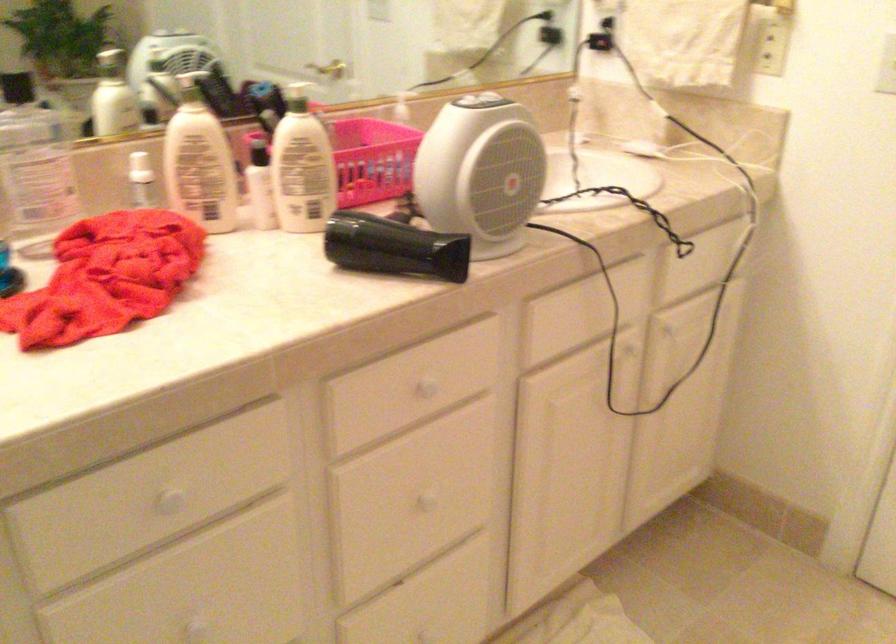
The height and width of the screenshot is (644, 896). What are the coordinates of `black hair dryer` in the screenshot? It's located at (393, 247).